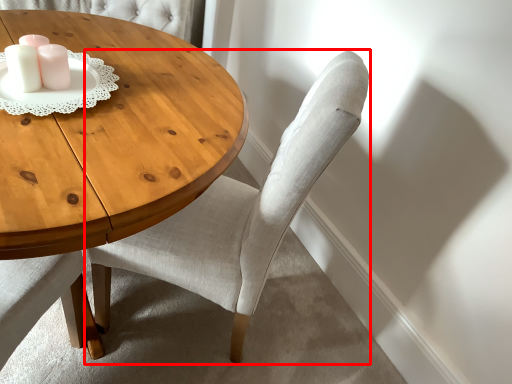
Question: From the image's perspective, what is the correct spatial relationship of chair (annotated by the red box) in relation to candle holder?

Choices:
 (A) below
 (B) above

Answer: (A)